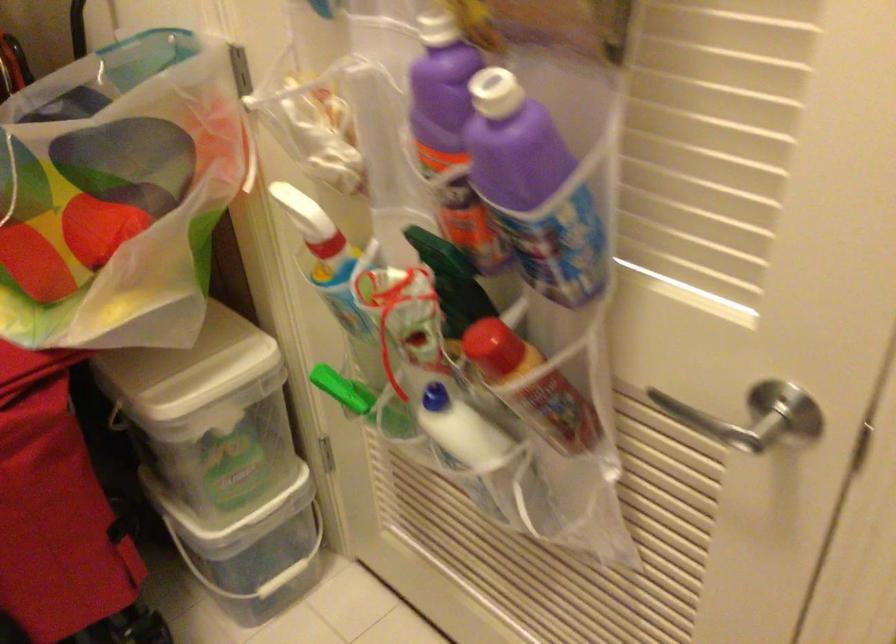
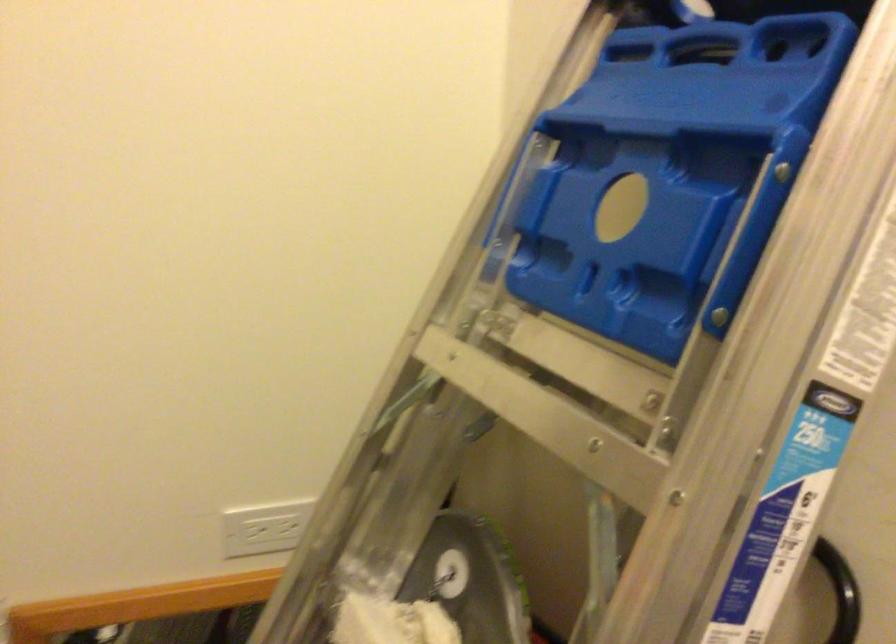
What movement of the cameraman would produce the second image?

The movement direction of the cameraman is left, forward.